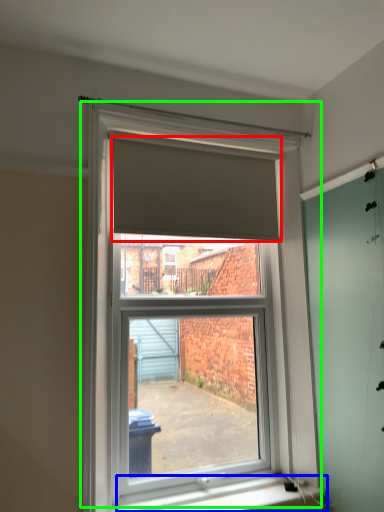
Question: Based on their relative distances, which object is nearer to blind (highlighted by a red box)? Choose from window sill (highlighted by a blue box) and window (highlighted by a green box).

Choices:
 (A) window sill
 (B) window

Answer: (B)